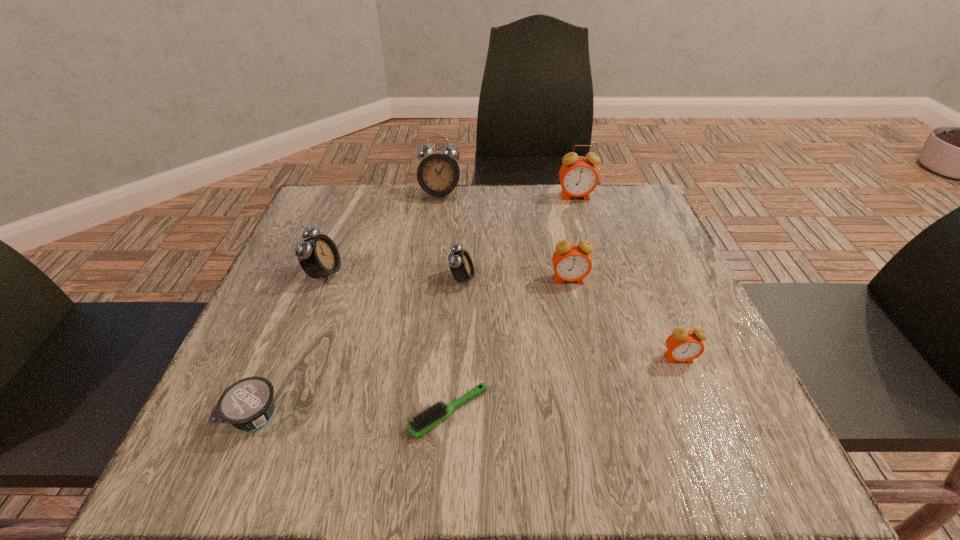
Where is `light hairbrush`? The image size is (960, 540). light hairbrush is located at coordinates (426, 420).

The height and width of the screenshot is (540, 960). I want to click on free space located 0.400m on the face of the biggest white alarm clock, so click(425, 314).

At what (x,y) coordinates should I click in order to perform the action: click on free space located 0.160m on the face of the farthest pink alarm clock. Please return your answer as a coordinate pair (x, y). Looking at the image, I should click on (588, 238).

Where is `vacant space located on the face of the leftmost alarm clock`? vacant space located on the face of the leftmost alarm clock is located at coordinates (404, 273).

Locate an element on the screen. This screenshot has width=960, height=540. vacant space positioned 0.240m on the face of the second nearest pink alarm clock is located at coordinates (590, 380).

Find the location of a particular element. This screenshot has height=540, width=960. free space located on the face of the smallest white alarm clock is located at coordinates (498, 279).

You are a GUI agent. You are given a task and a screenshot of the screen. Output one action in this format:
    pyautogui.click(x=<x>, y=<y>)
    Task: Click on the vacant space located on the face of the rightmost alarm clock
    The width and height of the screenshot is (960, 540).
    Given the screenshot: What is the action you would take?
    pyautogui.click(x=695, y=399)

Where is `free space located 0.300m on the back of the yogurt`? free space located 0.300m on the back of the yogurt is located at coordinates (313, 275).

Locate an element on the screen. This screenshot has width=960, height=540. free space located on the back of the hairbrush is located at coordinates (457, 268).

At what (x,y) coordinates should I click in order to perform the action: click on yogurt located in the near edge section of the desktop. Please return your answer as a coordinate pair (x, y). The width and height of the screenshot is (960, 540). Looking at the image, I should click on (248, 404).